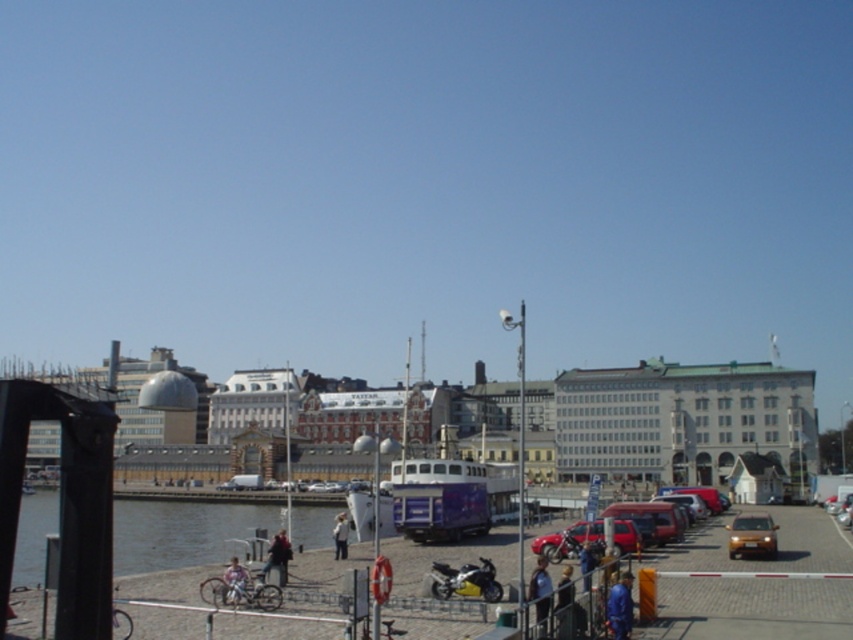
Question: Is metallic purple ferry at center in front of orange matte car at lower right?

Choices:
 (A) no
 (B) yes

Answer: (A)

Question: Which of the following is the closest to the observer?

Choices:
 (A) (566, 577)
 (B) (625, 604)
 (C) (583, 525)

Answer: (B)

Question: Which object appears farthest from the camera in this image?

Choices:
 (A) blue fabric jacket at lower center
 (B) shiny gold car at lower right
 (C) light brown leather jacket at center

Answer: (B)

Question: Which point appears farthest from the camera in this image?

Choices:
 (A) coord(346,532)
 (B) coord(621,528)
 (C) coord(454,506)

Answer: (C)

Question: Does light blue denim jacket at lower right have a lesser width compared to light blue fabric jacket at lower center?

Choices:
 (A) no
 (B) yes

Answer: (B)

Question: Is blue fabric jacket at lower center thinner than light brown leather jacket at center?

Choices:
 (A) no
 (B) yes

Answer: (B)